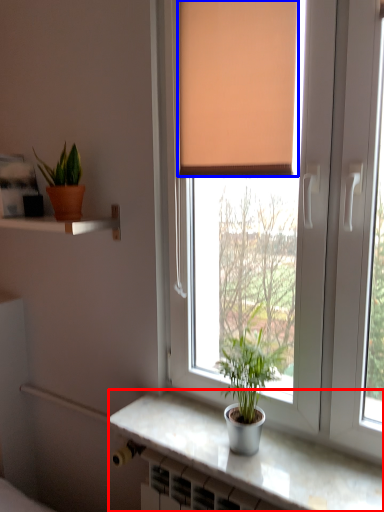
Question: Which object is closer to the camera taking this photo, counter top (highlighted by a red box) or curtain (highlighted by a blue box)?

Choices:
 (A) counter top
 (B) curtain

Answer: (A)